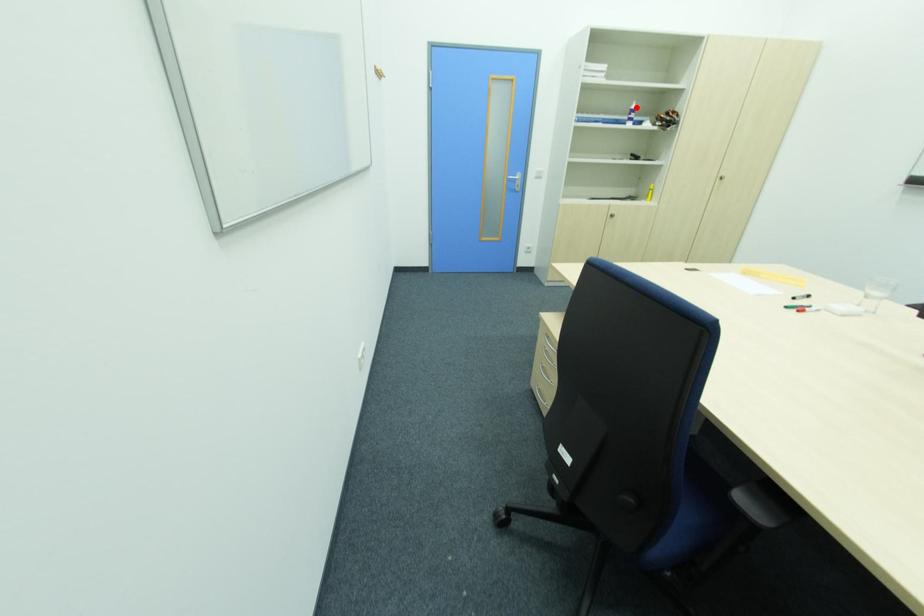
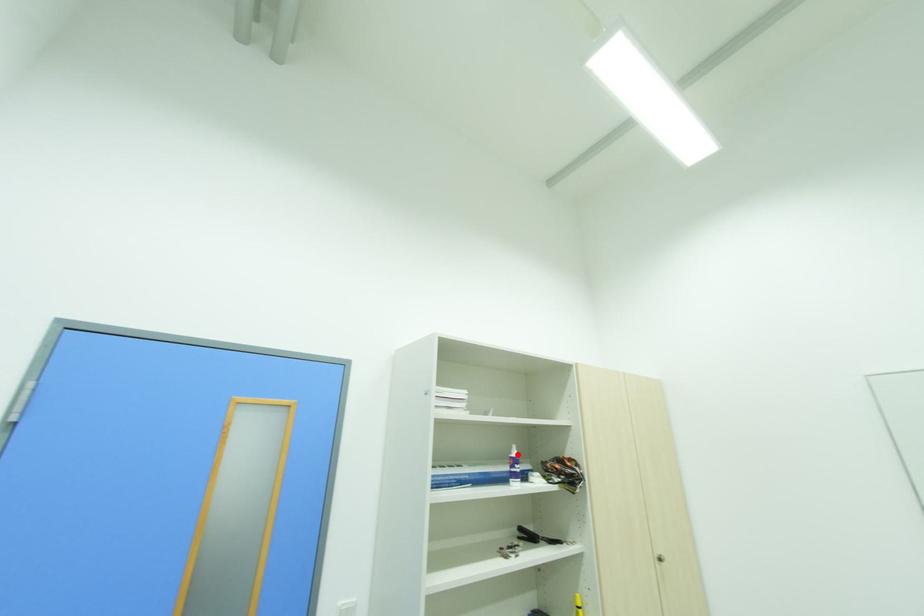
I am providing you with two images of the same scene from different viewpoints. A red point is marked on the first image and another point is marked on the second image. Is the red point in image1 aligned with the point shown in image2?

Yes